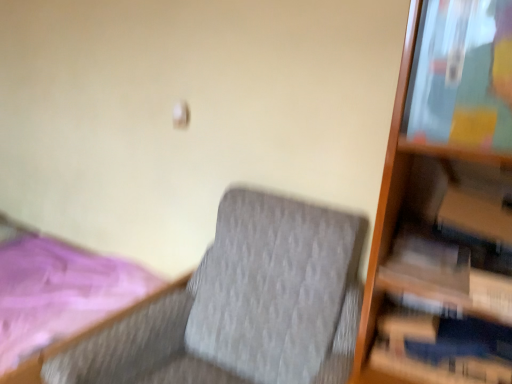
Question: Is textured gray fabric rocking chair at center not close to pink fabric bed at lower left?

Choices:
 (A) no
 (B) yes

Answer: (B)

Question: Does textured gray fabric rocking chair at center come behind pink fabric bed at lower left?

Choices:
 (A) no
 (B) yes

Answer: (A)

Question: From the image's perspective, is textured gray fabric rocking chair at center located beneath pink fabric bed at lower left?

Choices:
 (A) no
 (B) yes

Answer: (B)

Question: Considering the relative sizes of textured gray fabric rocking chair at center and pink fabric bed at lower left in the image provided, is textured gray fabric rocking chair at center smaller than pink fabric bed at lower left?

Choices:
 (A) yes
 (B) no

Answer: (A)

Question: Does textured gray fabric rocking chair at center have a lesser height compared to pink fabric bed at lower left?

Choices:
 (A) no
 (B) yes

Answer: (A)

Question: Is textured gray fabric rocking chair at center wider or thinner than white matte paperback book at right?

Choices:
 (A) wide
 (B) thin

Answer: (A)

Question: Visually, is textured gray fabric rocking chair at center positioned to the left or to the right of white matte paperback book at right?

Choices:
 (A) left
 (B) right

Answer: (A)

Question: Is textured gray fabric rocking chair at center inside the boundaries of white matte paperback book at right, or outside?

Choices:
 (A) outside
 (B) inside

Answer: (A)

Question: From a real-world perspective, is textured gray fabric rocking chair at center physically located above or below white matte paperback book at right?

Choices:
 (A) above
 (B) below

Answer: (B)

Question: Looking at their shapes, would you say textured gray fabric rocking chair at center is wider or thinner than pink fabric bed at lower left?

Choices:
 (A) wide
 (B) thin

Answer: (B)

Question: Is textured gray fabric rocking chair at center inside or outside of pink fabric bed at lower left?

Choices:
 (A) outside
 (B) inside

Answer: (A)

Question: Relative to pink fabric bed at lower left, is textured gray fabric rocking chair at center in front or behind?

Choices:
 (A) behind
 (B) front

Answer: (B)

Question: From the image's perspective, is textured gray fabric rocking chair at center above or below pink fabric bed at lower left?

Choices:
 (A) above
 (B) below

Answer: (B)

Question: From the image's perspective, is white matte paperback book at right positioned above or below textured gray fabric rocking chair at center?

Choices:
 (A) below
 (B) above

Answer: (B)

Question: Is white matte paperback book at right wider or thinner than textured gray fabric rocking chair at center?

Choices:
 (A) wide
 (B) thin

Answer: (B)